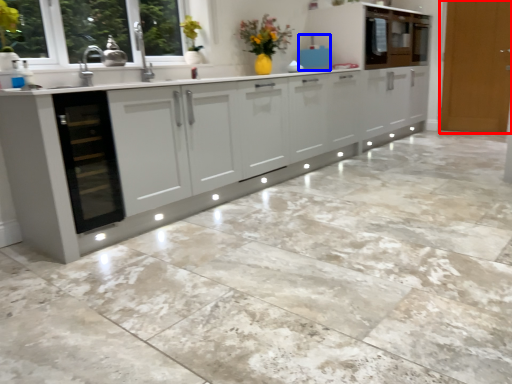
Question: Which of the following is the closest to the observer, door (highlighted by a red box) or appliance (highlighted by a blue box)?

Choices:
 (A) door
 (B) appliance

Answer: (B)